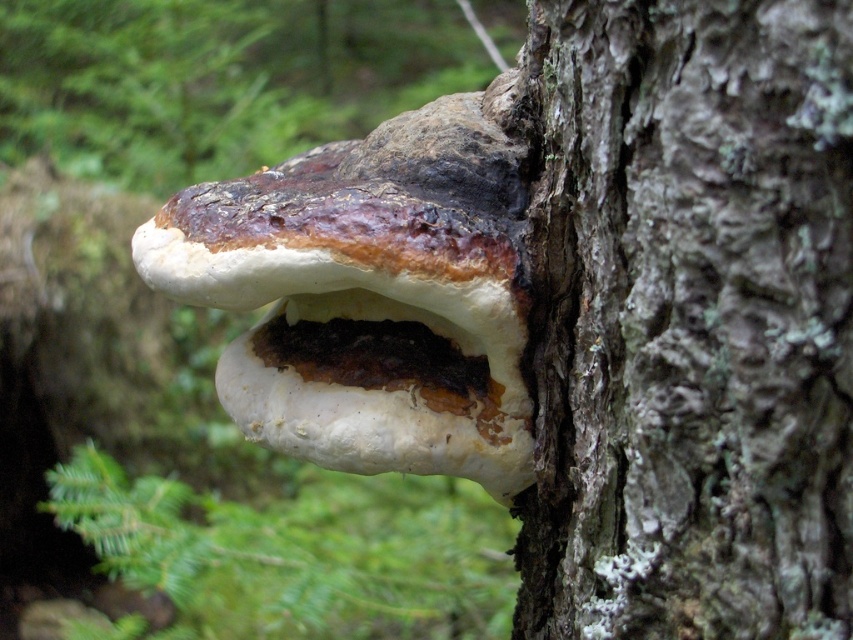
You are an arborist assessing the health of a tree. You notice the smooth bark tree trunk at center and the white leathery fungus at center. Which of these has a smaller width?

The smooth bark tree trunk at center has a lesser width compared to the white leathery fungus at center, so the smooth bark tree trunk at center has a smaller width.